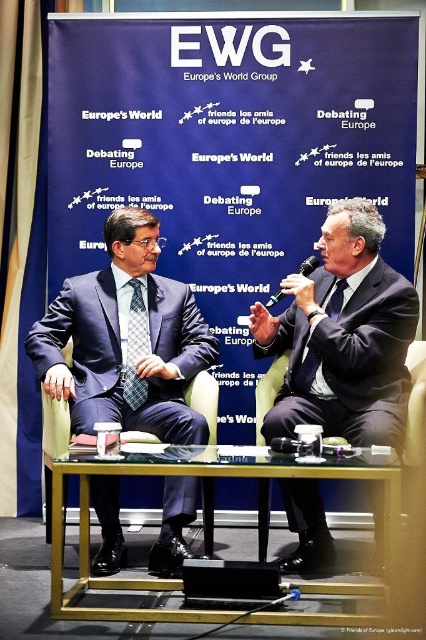
Who is shorter, matte black suit at center or black plastic microphone at right?

black plastic microphone at right is shorter.

Does matte black suit at center appear on the left side of black plastic microphone at right?

Incorrect, matte black suit at center is not on the left side of black plastic microphone at right.

Is point (313, 330) less distant than point (279, 298)?

Yes, it is.

Find the location of a particular element. matte black suit at center is located at coordinates (342, 337).

Between matte blue suit at center and clear glass table at center, which one appears on the left side from the viewer's perspective?

matte blue suit at center is more to the left.

Does matte blue suit at center appear under clear glass table at center?

Actually, matte blue suit at center is above clear glass table at center.

Where is `matte blue suit at center`? This screenshot has width=426, height=640. matte blue suit at center is located at coordinates (126, 339).

Identify the location of matte blue suit at center. (126, 339).

Who is shorter, matte blue suit at center or plaid silk tie at center?

plaid silk tie at center

Is matte blue suit at center taller than plaid silk tie at center?

Correct, matte blue suit at center is much taller as plaid silk tie at center.

Where is `matte blue suit at center`? This screenshot has width=426, height=640. matte blue suit at center is located at coordinates (126, 339).

This screenshot has height=640, width=426. I want to click on matte blue suit at center, so click(126, 339).